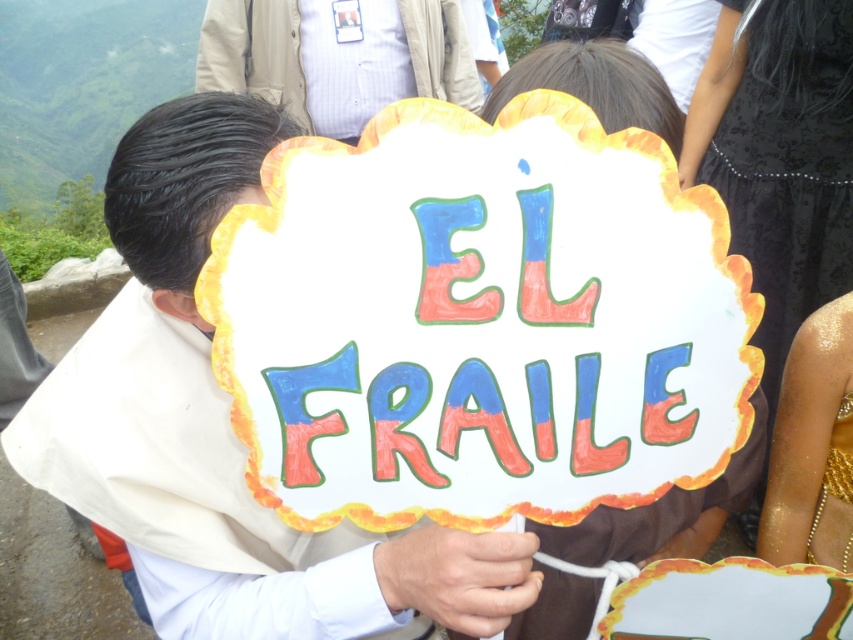
Question: Can you confirm if white paper sign at center is positioned below light brown jacket at center?

Choices:
 (A) no
 (B) yes

Answer: (B)

Question: Does white paper sign at center appear on the right side of light brown jacket at center?

Choices:
 (A) no
 (B) yes

Answer: (B)

Question: Does white paper sign at center have a lesser width compared to light brown jacket at center?

Choices:
 (A) yes
 (B) no

Answer: (A)

Question: Among these points, which one is nearest to the camera?

Choices:
 (A) (160, 476)
 (B) (341, 28)

Answer: (A)

Question: Which point is closer to the camera?

Choices:
 (A) (194, 508)
 (B) (339, 136)

Answer: (A)